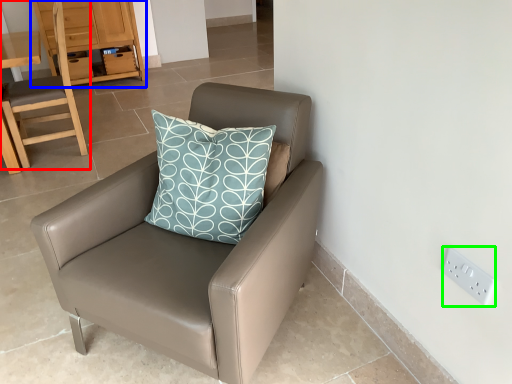
Question: Which object is positioned farthest from chair (highlighted by a red box)? Select from dresser (highlighted by a blue box) and electric outlet (highlighted by a green box).

Choices:
 (A) dresser
 (B) electric outlet

Answer: (B)